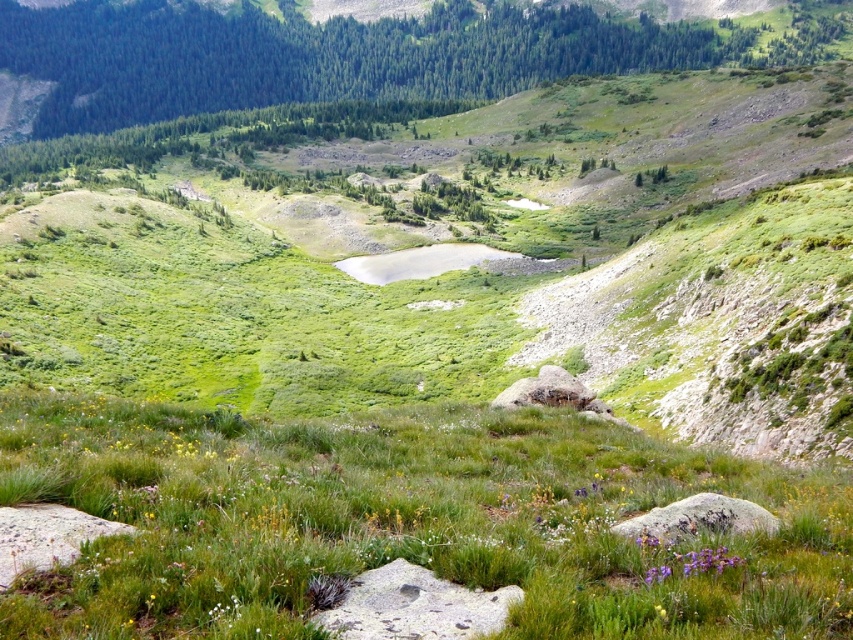
You are a hiker carrying a 4.5 foot long backpack. You want to place your backpack between the gray rough rock at lower right and the purple matte flower at lower right. Is there enough space between them to place your backpack?

The gray rough rock at lower right is 5.39 feet from the purple matte flower at lower right. Since your backpack is 4.5 feet long, there is enough space between them to place your backpack.